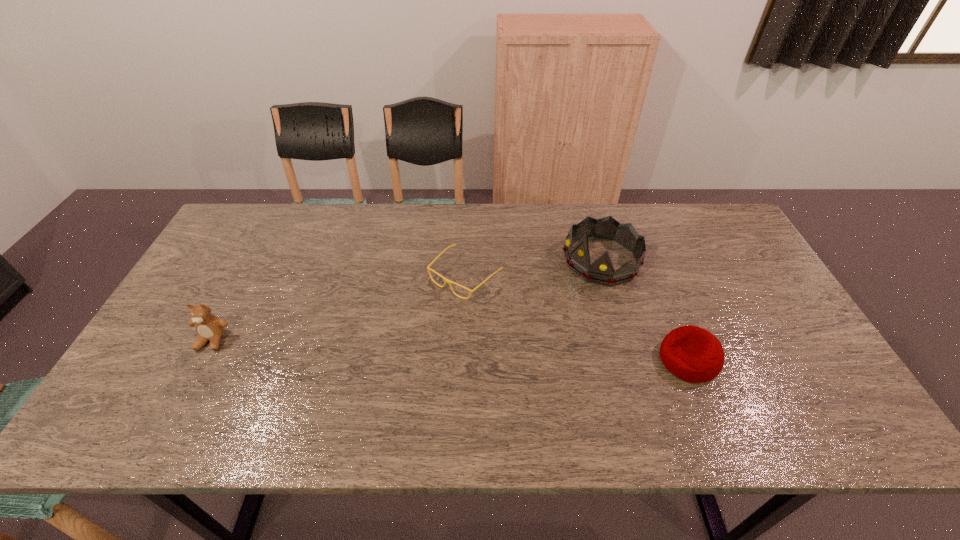
Where is `free space between the second tallest object and the third tallest object`? The image size is (960, 540). free space between the second tallest object and the third tallest object is located at coordinates (450, 350).

Where is `free area in between the leftmost object and the spectacles`? This screenshot has height=540, width=960. free area in between the leftmost object and the spectacles is located at coordinates (339, 308).

Where is `free space between the tiara and the beanbag`? Image resolution: width=960 pixels, height=540 pixels. free space between the tiara and the beanbag is located at coordinates (645, 310).

Choose which object is the nearest neighbor to the leftmost object. Please provide its 2D coordinates. Your answer should be formatted as a tuple, i.e. [(x, y)], where the tuple contains the x and y coordinates of a point satisfying the conditions above.

[(449, 282)]

The image size is (960, 540). I want to click on the second closest object to the spectacles, so click(x=693, y=354).

At what (x,y) coordinates should I click in order to perform the action: click on vacant space that satisfies the following two spatial constraints: 1. on the front-facing side of the third tallest object; 2. on the seat area of the teddy bear. Please return your answer as a coordinate pair (x, y). This screenshot has height=540, width=960. Looking at the image, I should click on (202, 360).

You are a GUI agent. You are given a task and a screenshot of the screen. Output one action in this format:
    pyautogui.click(x=<x>, y=<y>)
    Task: Click on the vacant space that satisfies the following two spatial constraints: 1. on the front-facing side of the beanbag; 2. on the seat area of the leftmost object
    The height and width of the screenshot is (540, 960).
    Given the screenshot: What is the action you would take?
    pyautogui.click(x=202, y=360)

Find the location of a particular element. vacant position in the image that satisfies the following two spatial constraints: 1. on the front-facing side of the beanbag; 2. on the seat area of the leftmost object is located at coordinates (202, 360).

Find the location of a particular element. The width and height of the screenshot is (960, 540). blank area in the image that satisfies the following two spatial constraints: 1. on the front-facing side of the teddy bear; 2. on the seat area of the third tallest object is located at coordinates (202, 360).

The image size is (960, 540). I want to click on free space that satisfies the following two spatial constraints: 1. on the front side of the beanbag; 2. on the seat area of the shortest object, so click(463, 360).